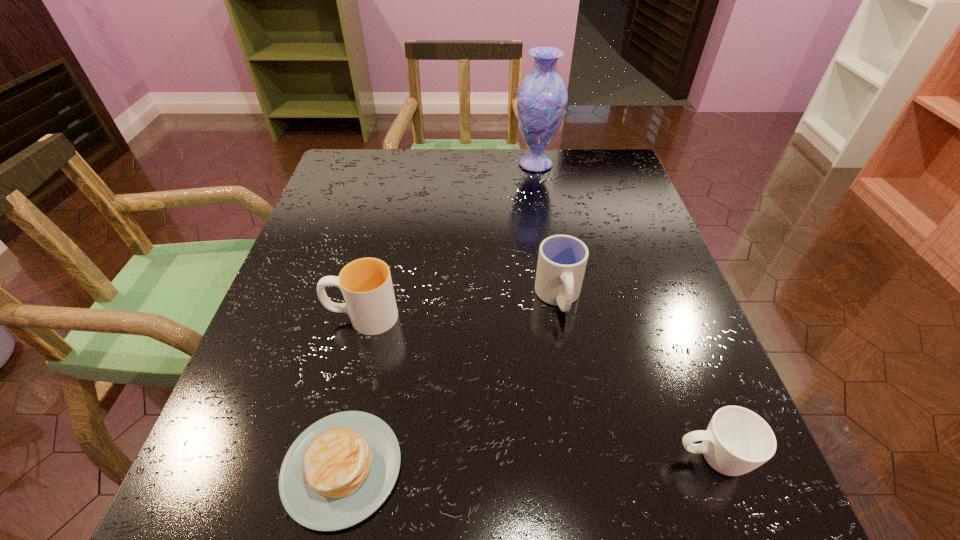
Image resolution: width=960 pixels, height=540 pixels. In order to click on the tallest object in this screenshot , I will do `click(542, 97)`.

This screenshot has height=540, width=960. Identify the location of vase. [542, 97].

I want to click on the leftmost cup, so click(x=366, y=284).

Locate an element on the screen. the second cup from right to left is located at coordinates (562, 259).

What are the coordinates of `the rightmost cup` in the screenshot? It's located at (737, 440).

The height and width of the screenshot is (540, 960). What are the coordinates of `the second shortest object` in the screenshot? It's located at (737, 440).

You are a GUI agent. You are given a task and a screenshot of the screen. Output one action in this format:
    pyautogui.click(x=<x>, y=<y>)
    Task: Click on the shortest object
    This screenshot has height=540, width=960.
    Given the screenshot: What is the action you would take?
    pyautogui.click(x=341, y=469)

Locate an element on the screen. The image size is (960, 540). free region located on the right of the farthest object is located at coordinates (580, 164).

The image size is (960, 540). Find the location of `blank space located with the handle on the side of the second cup from right to left`. blank space located with the handle on the side of the second cup from right to left is located at coordinates (577, 406).

Where is `vacant space situated with the handle on the side of the fourth tallest object`? This screenshot has width=960, height=540. vacant space situated with the handle on the side of the fourth tallest object is located at coordinates (529, 458).